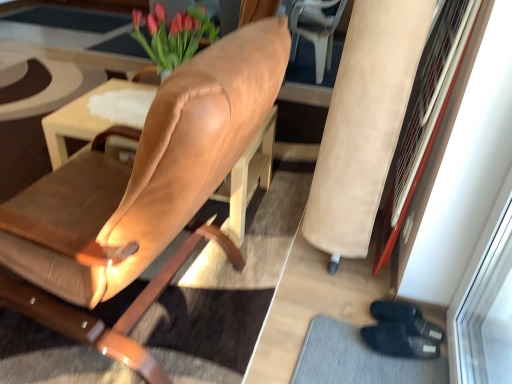
Question: Should I look upward or downward to see suede-like beige armchair at right?

Choices:
 (A) up
 (B) down

Answer: (A)

Question: Is leather armchair at upper right smaller than matte brown table at center?

Choices:
 (A) yes
 (B) no

Answer: (B)

Question: Is leather armchair at upper right turned away from matte brown table at center?

Choices:
 (A) yes
 (B) no

Answer: (B)

Question: Are leather armchair at upper right and matte brown table at center making contact?

Choices:
 (A) no
 (B) yes

Answer: (A)

Question: From the image's perspective, is leather armchair at upper right beneath matte brown table at center?

Choices:
 (A) no
 (B) yes

Answer: (A)

Question: Considering the relative sizes of leather armchair at upper right and matte brown table at center in the image provided, is leather armchair at upper right wider than matte brown table at center?

Choices:
 (A) no
 (B) yes

Answer: (A)

Question: Considering the relative sizes of leather armchair at upper right and matte brown table at center in the image provided, is leather armchair at upper right bigger than matte brown table at center?

Choices:
 (A) yes
 (B) no

Answer: (A)

Question: Is leather armchair at upper right turned away from black fabric doormat at lower right?

Choices:
 (A) no
 (B) yes

Answer: (A)

Question: Is leather armchair at upper right completely or partially outside of black fabric doormat at lower right?

Choices:
 (A) yes
 (B) no

Answer: (A)

Question: Can you confirm if leather armchair at upper right is smaller than black fabric doormat at lower right?

Choices:
 (A) yes
 (B) no

Answer: (B)

Question: Is leather armchair at upper right positioned far away from black fabric doormat at lower right?

Choices:
 (A) yes
 (B) no

Answer: (A)

Question: Can you confirm if leather armchair at upper right is taller than black fabric doormat at lower right?

Choices:
 (A) no
 (B) yes

Answer: (B)

Question: Is leather armchair at upper right positioned in front of black fabric doormat at lower right?

Choices:
 (A) yes
 (B) no

Answer: (B)

Question: Is leather armchair at upper right at the back of suede-like beige armchair at right?

Choices:
 (A) no
 (B) yes

Answer: (A)